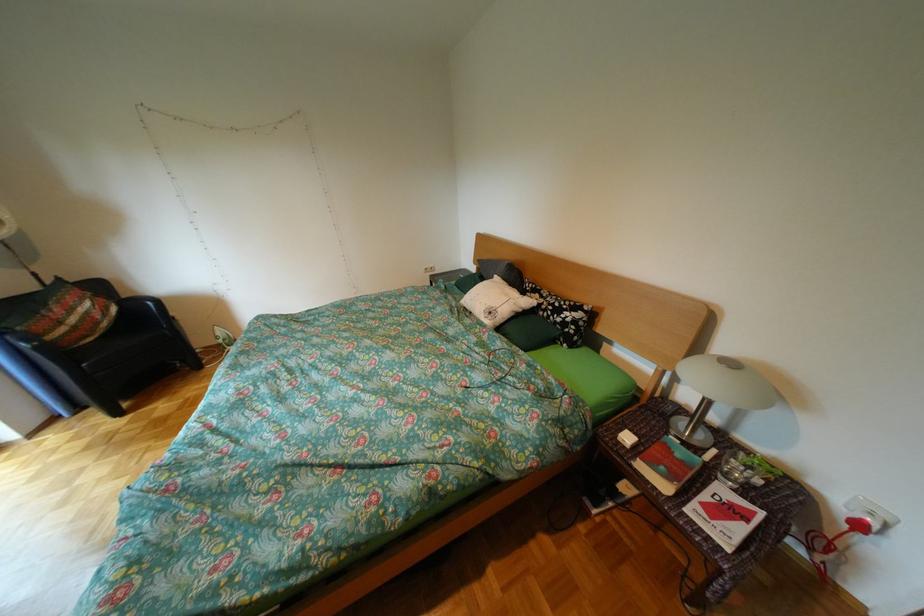
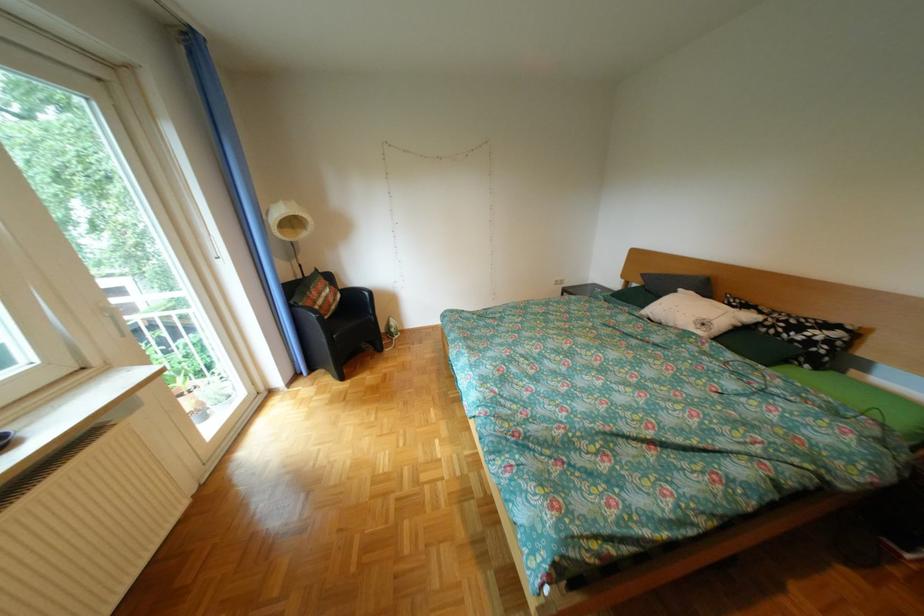
In the second image, find the point that corresponds to pixel 505 314 in the first image.

(718, 325)